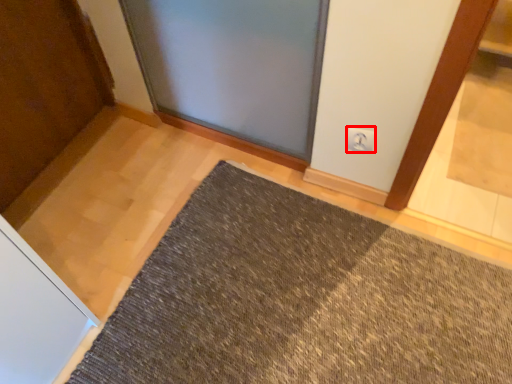
Question: From the image's perspective, considering the relative positions of electric outlet (annotated by the red box) and mat in the image provided, where is electric outlet (annotated by the red box) located with respect to the staircase?

Choices:
 (A) above
 (B) below

Answer: (A)